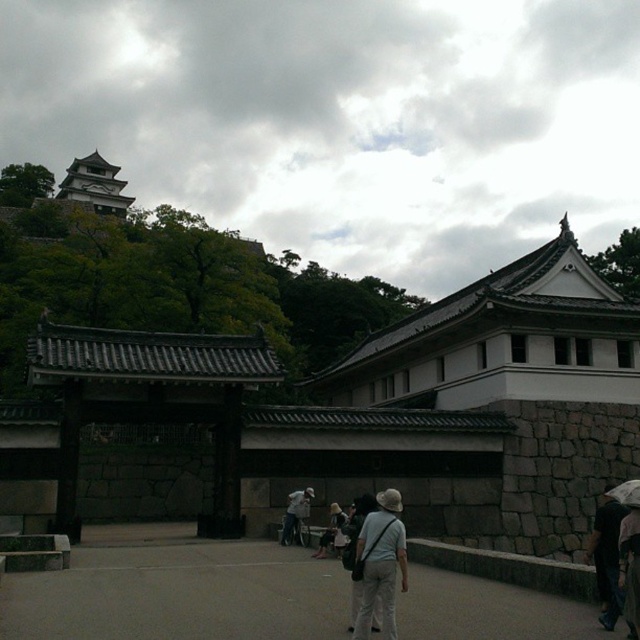
Between point (109, 172) and point (300, 516), which one is positioned behind?

The point (109, 172) is more distant.

Based on the photo, is stone gray tower at upper left smaller than white fabric bag at center?

Incorrect, stone gray tower at upper left is not smaller in size than white fabric bag at center.

Image resolution: width=640 pixels, height=640 pixels. Find the location of `stone gray tower at upper left`. stone gray tower at upper left is located at coordinates tap(93, 186).

Does dark gray fabric hat at lower right appear on the right side of white fabric bag at center?

Indeed, dark gray fabric hat at lower right is positioned on the right side of white fabric bag at center.

Image resolution: width=640 pixels, height=640 pixels. Find the location of `dark gray fabric hat at lower right`. dark gray fabric hat at lower right is located at coordinates (630, 564).

Is dark brown leather backpack at lower right above dark gray fabric hat at lower right?

Incorrect, dark brown leather backpack at lower right is not positioned above dark gray fabric hat at lower right.

Does dark brown leather backpack at lower right appear under dark gray fabric hat at lower right?

Correct, dark brown leather backpack at lower right is located below dark gray fabric hat at lower right.

This screenshot has width=640, height=640. Describe the element at coordinates (608, 556) in the screenshot. I see `dark brown leather backpack at lower right` at that location.

Where is `dark brown leather backpack at lower right`? This screenshot has width=640, height=640. dark brown leather backpack at lower right is located at coordinates (608, 556).